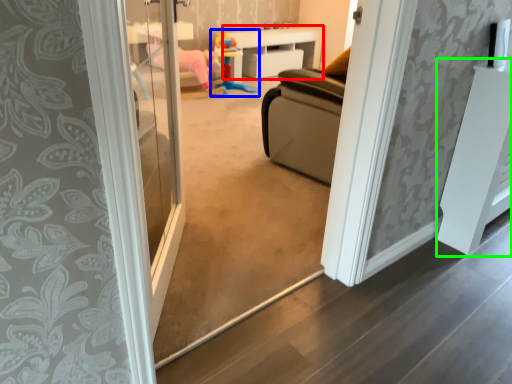
Question: Based on their relative distances, which object is farther from furniture (highlighted by a red box)? Choose from toy (highlighted by a blue box) and furniture (highlighted by a green box).

Choices:
 (A) toy
 (B) furniture

Answer: (B)